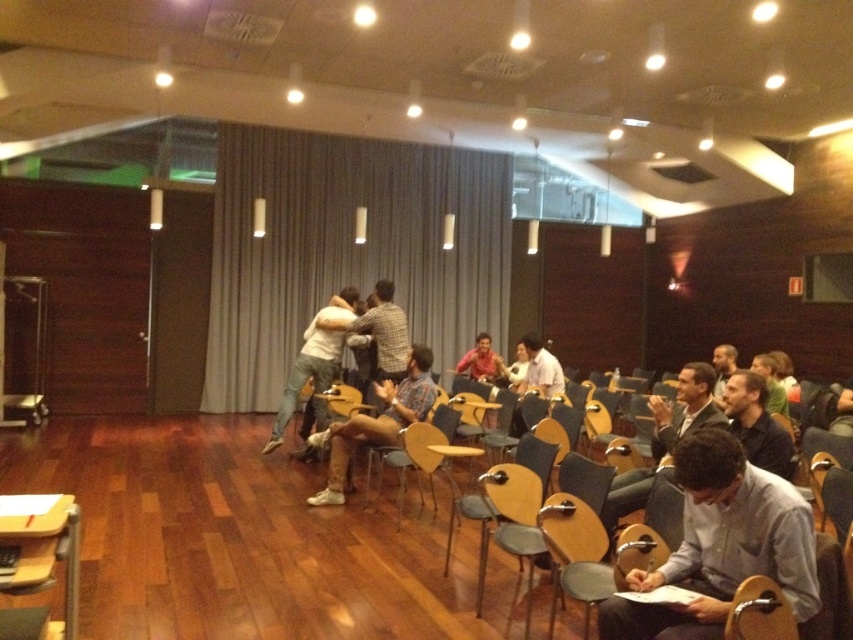
Does plaid shirt at center have a greater height compared to matte red shirt at center?

Correct, plaid shirt at center is much taller as matte red shirt at center.

Between plaid shirt at center and matte red shirt at center, which one has more height?

With more height is plaid shirt at center.

I want to click on plaid shirt at center, so click(386, 332).

You are a GUI agent. You are given a task and a screenshot of the screen. Output one action in this format:
    pyautogui.click(x=<x>, y=<y>)
    Task: Click on the plaid shirt at center
    The height and width of the screenshot is (640, 853).
    Given the screenshot: What is the action you would take?
    pyautogui.click(x=386, y=332)

Is gray shirt at lower right further to the viewer compared to light gray jeans at center?

No, it is not.

How far apart are gray shirt at lower right and light gray jeans at center?

The distance of gray shirt at lower right from light gray jeans at center is 4.44 meters.

Identify the location of gray shirt at lower right. (721, 545).

Where is `gray shirt at lower right`? This screenshot has height=640, width=853. gray shirt at lower right is located at coordinates (721, 545).

Between plaid shirt at center and white shirt at center, which one has less height?

With less height is white shirt at center.

Who is positioned more to the right, plaid shirt at center or white shirt at center?

Positioned to the right is white shirt at center.

Locate an element on the screen. The image size is (853, 640). plaid shirt at center is located at coordinates click(386, 332).

At what (x,y) coordinates should I click in order to perform the action: click on plaid shirt at center. Please return your answer as a coordinate pair (x, y). Looking at the image, I should click on (386, 332).